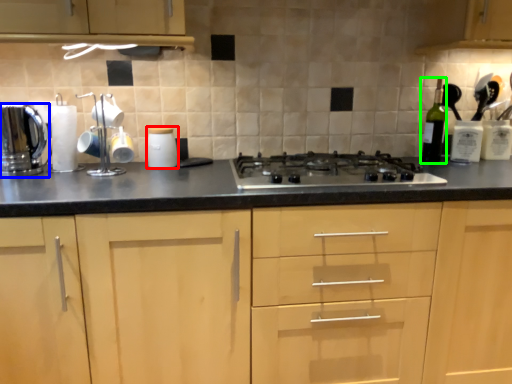
Question: Which is nearer to the kitchen appliance (highlighted by a red box)? kitchen appliance (highlighted by a blue box) or bottle (highlighted by a green box).

Choices:
 (A) kitchen appliance
 (B) bottle

Answer: (A)